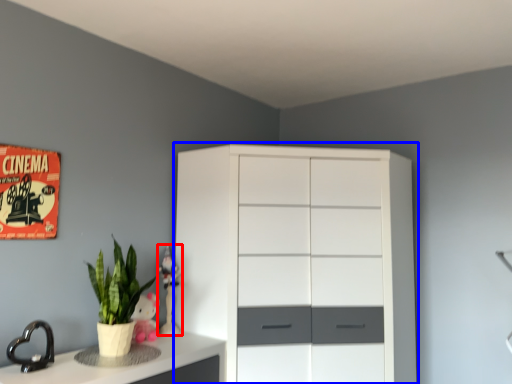
Question: Which of the following is the closest to the observer, toy (highlighted by a red box) or chest of drawers (highlighted by a blue box)?

Choices:
 (A) toy
 (B) chest of drawers

Answer: (B)